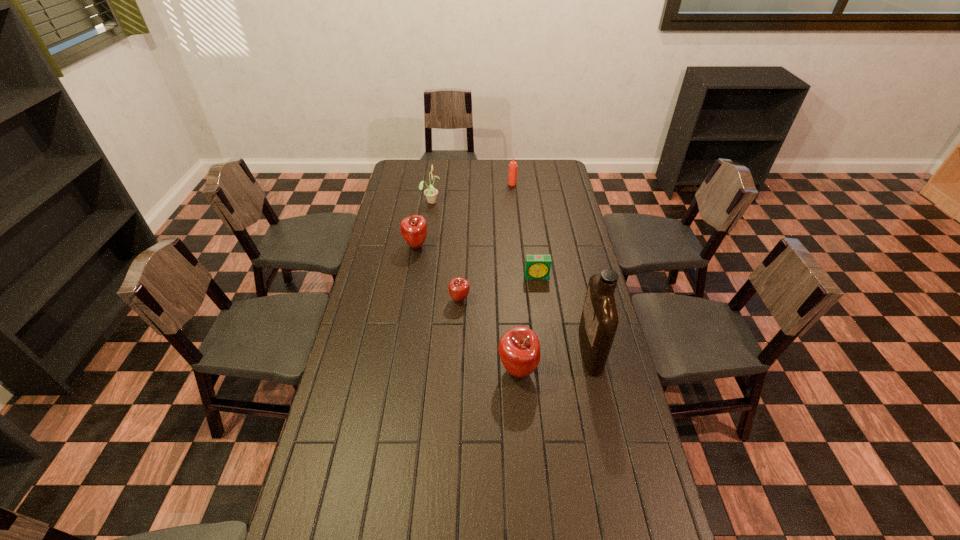
Locate an element on the screen. vacant area that lies between the second apple from left to right and the liquor is located at coordinates (525, 325).

The image size is (960, 540). In order to click on free space that is in between the sixth nearest object and the alarm clock in this screenshot , I will do `click(484, 239)`.

Where is `vacant space that's between the second shortest apple and the alarm clock`? Image resolution: width=960 pixels, height=540 pixels. vacant space that's between the second shortest apple and the alarm clock is located at coordinates (476, 261).

I want to click on vacant space that is in between the liquor and the fourth farthest object, so click(564, 313).

Identify the location of free space between the farthest object and the rightmost object. The image size is (960, 540). (551, 267).

I want to click on vacant region between the alarm clock and the tallest object, so click(564, 313).

Find the location of a particular element. the closest object to the fifth nearest object is located at coordinates (430, 193).

What are the coordinates of `object that is the fifth closest one to the nearest apple` in the screenshot? It's located at (430, 193).

Identify the location of the second closest apple to the nearest apple. (413, 228).

Select which apple appears as the second closest to the alarm clock. Please provide its 2D coordinates. Your answer should be formatted as a tuple, i.e. [(x, y)], where the tuple contains the x and y coordinates of a point satisfying the conditions above.

[(519, 348)]